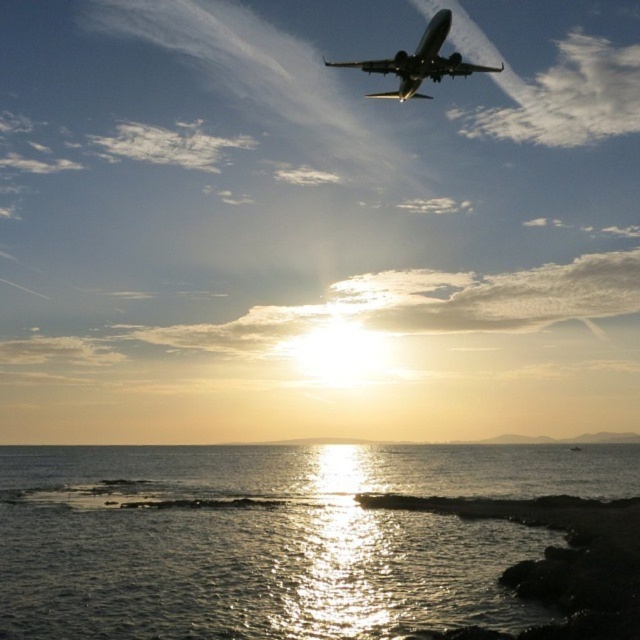
Based on the photo, who is positioned more to the left, shiny reflective water at lower center or metallic silver airplane at upper center?

shiny reflective water at lower center is more to the left.

Can you confirm if shiny reflective water at lower center is positioned to the right of metallic silver airplane at upper center?

In fact, shiny reflective water at lower center is to the left of metallic silver airplane at upper center.

This screenshot has width=640, height=640. What do you see at coordinates (273, 538) in the screenshot?
I see `shiny reflective water at lower center` at bounding box center [273, 538].

Find the location of a particular element. This screenshot has height=640, width=640. shiny reflective water at lower center is located at coordinates (273, 538).